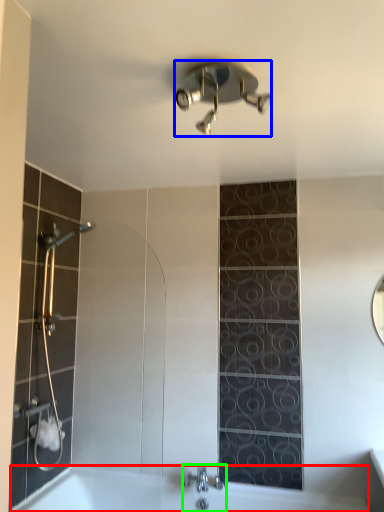
Question: Based on their relative distances, which object is nearer to bath (highlighted by a red box)? Choose from shower (highlighted by a blue box) and tap (highlighted by a green box).

Choices:
 (A) shower
 (B) tap

Answer: (B)